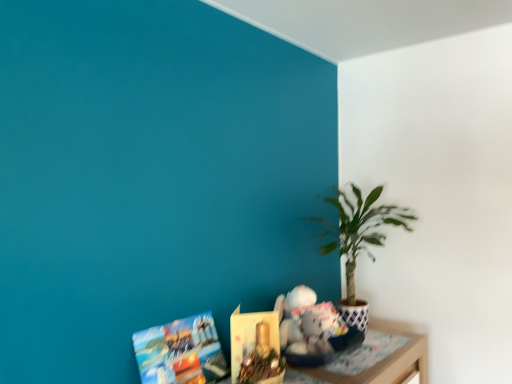
Question: Should I look upward or downward to see matte paper book at lower left, arranged as the second book when viewed from the right?

Choices:
 (A) up
 (B) down

Answer: (B)

Question: Is wooden table at lower right smaller than green leafy plant at right?

Choices:
 (A) yes
 (B) no

Answer: (A)

Question: Is wooden table at lower right turned away from green leafy plant at right?

Choices:
 (A) yes
 (B) no

Answer: (A)

Question: Is wooden table at lower right far from green leafy plant at right?

Choices:
 (A) no
 (B) yes

Answer: (A)

Question: Is wooden table at lower right to the right of green leafy plant at right from the viewer's perspective?

Choices:
 (A) no
 (B) yes

Answer: (A)

Question: Does wooden table at lower right contain green leafy plant at right?

Choices:
 (A) no
 (B) yes

Answer: (A)

Question: Is wooden table at lower right positioned in front of green leafy plant at right?

Choices:
 (A) yes
 (B) no

Answer: (A)

Question: Can you confirm if matte paper book at lower center, which is the 2th book from left to right, is taller than matte paper book at lower left, arranged as the second book when viewed from the right?

Choices:
 (A) no
 (B) yes

Answer: (A)

Question: Considering the relative sizes of matte paper book at lower center, the first book positioned from the right, and matte paper book at lower left, arranged as the second book when viewed from the right, in the image provided, is matte paper book at lower center, the first book positioned from the right, bigger than matte paper book at lower left, arranged as the second book when viewed from the right,?

Choices:
 (A) yes
 (B) no

Answer: (A)

Question: Does matte paper book at lower center, which is the 2th book from left to right, come behind matte paper book at lower left, arranged as the second book when viewed from the right?

Choices:
 (A) yes
 (B) no

Answer: (A)

Question: Is matte paper book at lower center, which is the 2th book from left to right, oriented away from matte paper book at lower left, arranged as the second book when viewed from the right?

Choices:
 (A) yes
 (B) no

Answer: (B)

Question: Does matte paper book at lower center, which is the 2th book from left to right, have a lesser height compared to matte paper book at lower left, the 1th book when ordered from left to right?

Choices:
 (A) yes
 (B) no

Answer: (A)

Question: Considering the relative sizes of matte paper book at lower center, the first book positioned from the right, and matte paper book at lower left, the 1th book when ordered from left to right, in the image provided, is matte paper book at lower center, the first book positioned from the right, thinner than matte paper book at lower left, the 1th book when ordered from left to right,?

Choices:
 (A) yes
 (B) no

Answer: (B)

Question: From the image's perspective, would you say matte paper book at lower left, the 1th book when ordered from left to right, is positioned over green leafy plant at right?

Choices:
 (A) yes
 (B) no

Answer: (B)